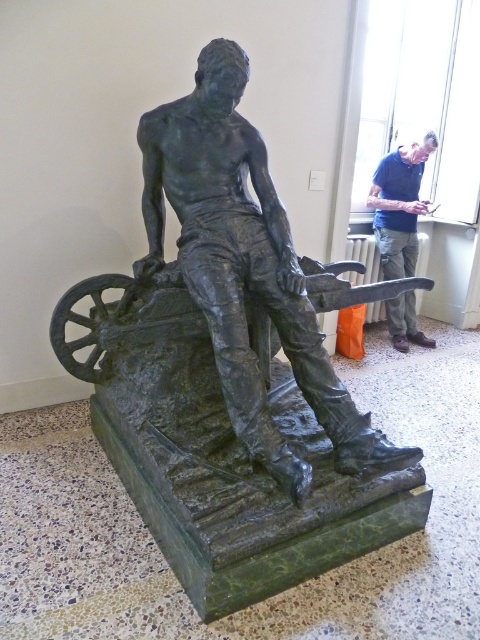
Based on the photo, you are standing in the museum and want to take a photo of the bronze statue at center. The museum requires that all photos must include the statue and at least one other object in the scene. Is there another object in the scene that you can include in your photo to comply with this rule?

No, there are no other objects besides the bronze statue at center mentioned in the scene description, so you cannot comply with the museum rule.

You are an art curator planning to move the bronze statue at center and the blue shirt at upper right to a new exhibition space. The doorway to the new space has a width of 1.2 meters. Based on their sizes, can both items pass through the doorway without needing to be disassembled?

The bronze statue at center might be wider than blue shirt at upper right, so it is uncertain if the bronze statue at center can pass through the 1.2 meter doorway. The blue shirt at upper right is likely narrower and may fit, but the statue requires further measurement to confirm its width.